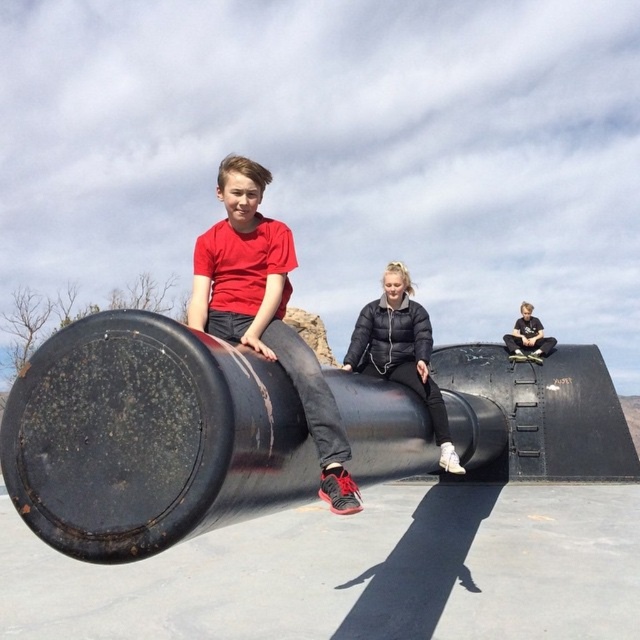
You are standing at the origin point in the scene. The rusty metal cannon at center is at coordinates 0.684, 0.233. If you want to walk directly to the cannon, which direction should you head?

The rusty metal cannon at center is located at point (148, 436), so you should head northeast to reach it.

You are trying to determine if the rusty metal cannon at center can fit through a doorway that is the same width as the black puffy jacket at center. Based on their sizes, will the cannon fit?

The rusty metal cannon at center might be wider than the black puffy jacket at center, so it may not fit through the doorway.

You are standing in front of the rusty metal cannon at center and the black puffy jacket at center. Which object is closer to you?

The rusty metal cannon at center is closer to you than the black puffy jacket at center.